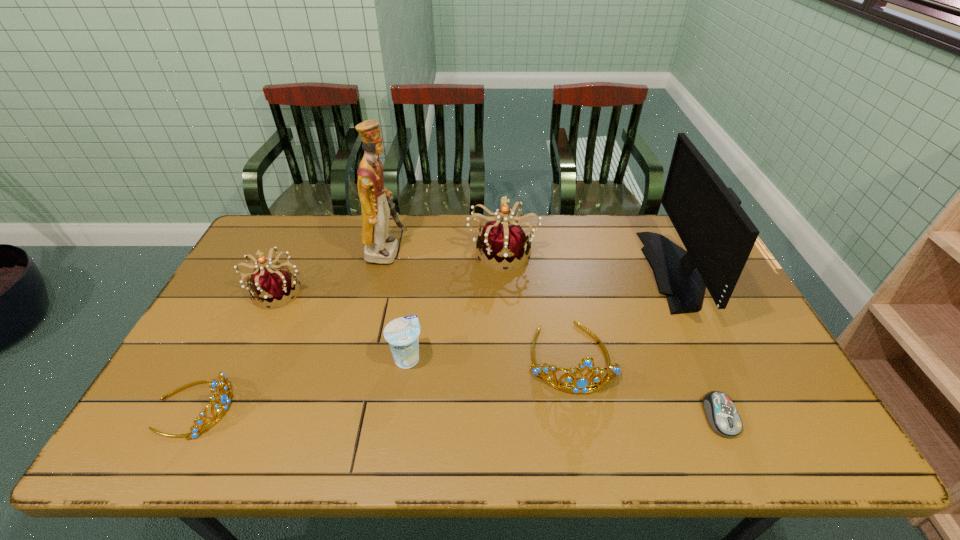
Find the location of a particular element. The image size is (960, 540). object present at the far right corner is located at coordinates (718, 235).

The image size is (960, 540). What are the coordinates of `vacant space at the far edge` in the screenshot? It's located at (524, 229).

I want to click on free space at the near edge of the desktop, so click(x=626, y=434).

Locate an element on the screen. vacant area at the left edge is located at coordinates (155, 411).

In order to click on vacant space at the right edge of the desktop in this screenshot , I will do `click(785, 393)`.

The image size is (960, 540). In the image, there is a desktop. Identify the location of vacant space at the far left corner. (275, 219).

This screenshot has height=540, width=960. Identify the location of vacant position at the far right corner of the desktop. (660, 220).

In the image, there is a desktop. Where is `vacant area at the near right corner`? This screenshot has width=960, height=540. vacant area at the near right corner is located at coordinates (765, 426).

Locate an element on the screen. The height and width of the screenshot is (540, 960). free area in between the monitor and the smaller red tiara is located at coordinates (480, 281).

You are a GUI agent. You are given a task and a screenshot of the screen. Output one action in this format:
    pyautogui.click(x=<x>, y=<y>)
    Task: Click on the free space that is in between the nutcracker and the seventh shortest object
    Image resolution: width=960 pixels, height=540 pixels.
    Given the screenshot: What is the action you would take?
    pyautogui.click(x=535, y=260)